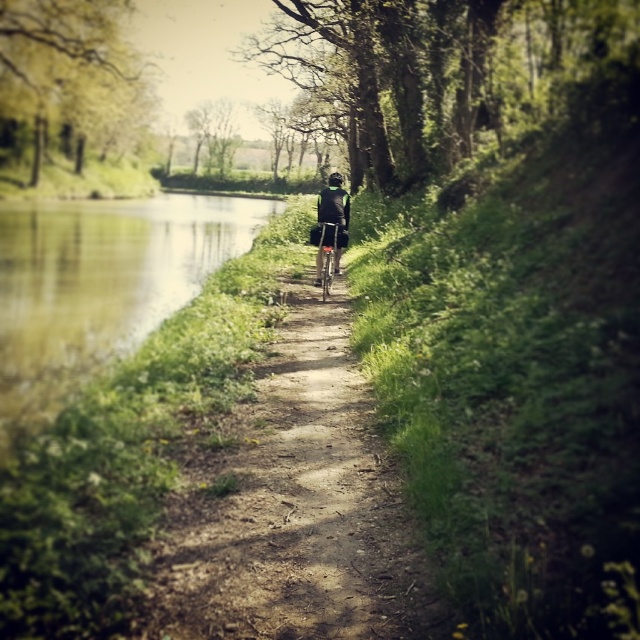
Who is more forward, [288,51] or [342,200]?

Point [342,200]

The height and width of the screenshot is (640, 640). I want to click on green leafy tree at center, so click(x=435, y=72).

Is black matte jacket at center to the right of green leafy tree at upper center from the viewer's perspective?

Correct, you'll find black matte jacket at center to the right of green leafy tree at upper center.

Which is in front, point (342, 241) or point (228, 128)?

Point (342, 241) is more forward.

Find the location of a particular element. This screenshot has width=640, height=640. black matte jacket at center is located at coordinates (330, 227).

The image size is (640, 640). Describe the element at coordinates (435, 72) in the screenshot. I see `green leafy tree at center` at that location.

In order to click on green leafy tree at center in this screenshot , I will do `click(435, 72)`.

The width and height of the screenshot is (640, 640). In order to click on green leafy tree at center in this screenshot , I will do `click(435, 72)`.